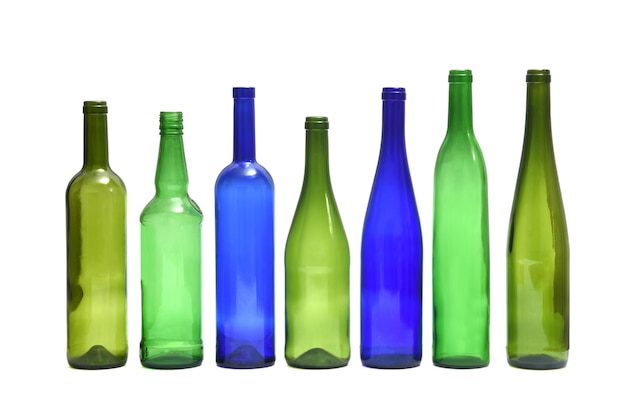
Locate an element on the screen. The height and width of the screenshot is (417, 626). bottles is located at coordinates (98, 261), (173, 262), (244, 256), (312, 256), (391, 255), (459, 257), (539, 255).